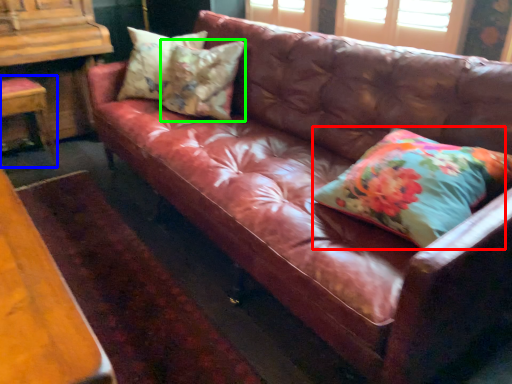
Question: Considering the real-world distances, which object is closest to pillow (highlighted by a red box)? chair (highlighted by a blue box) or pillow (highlighted by a green box).

Choices:
 (A) chair
 (B) pillow

Answer: (B)